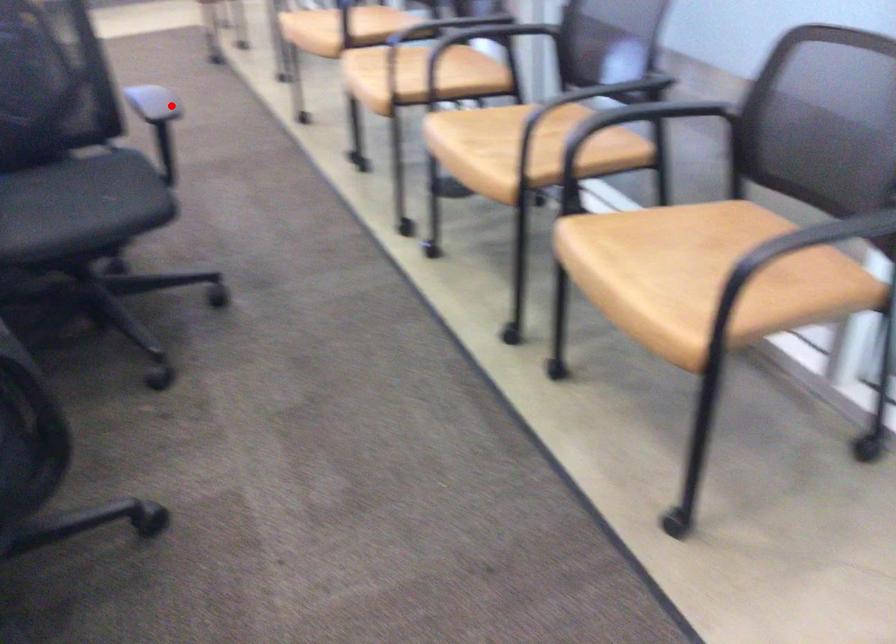
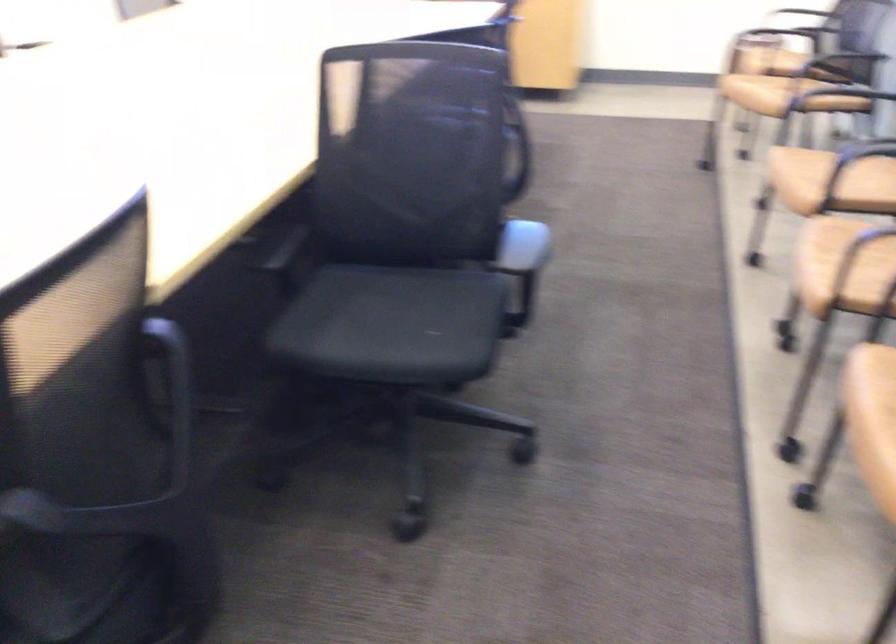
Question: I am providing you with two images of the same scene from different viewpoints. A red point is marked on the first image. Can you still see the location of the red point in image 2?

Choices:
 (A) Yes
 (B) No

Answer: (A)